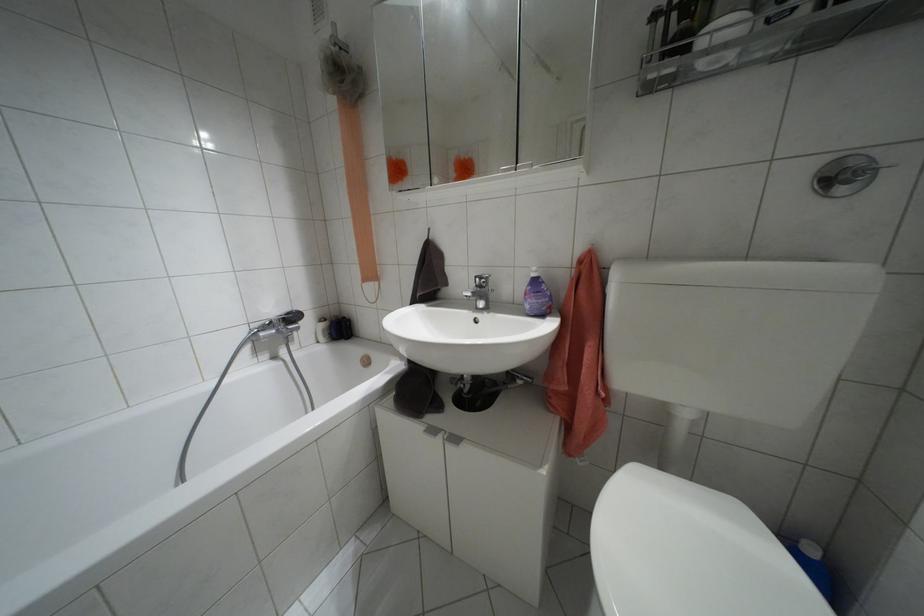
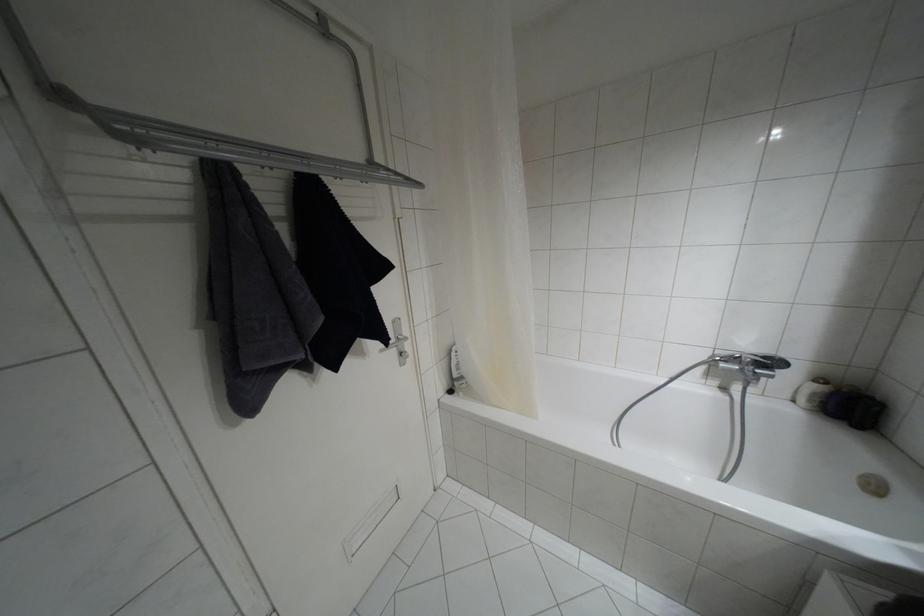
Find the pixel in the second image that matches the point at 286,313 in the first image.

(763, 357)